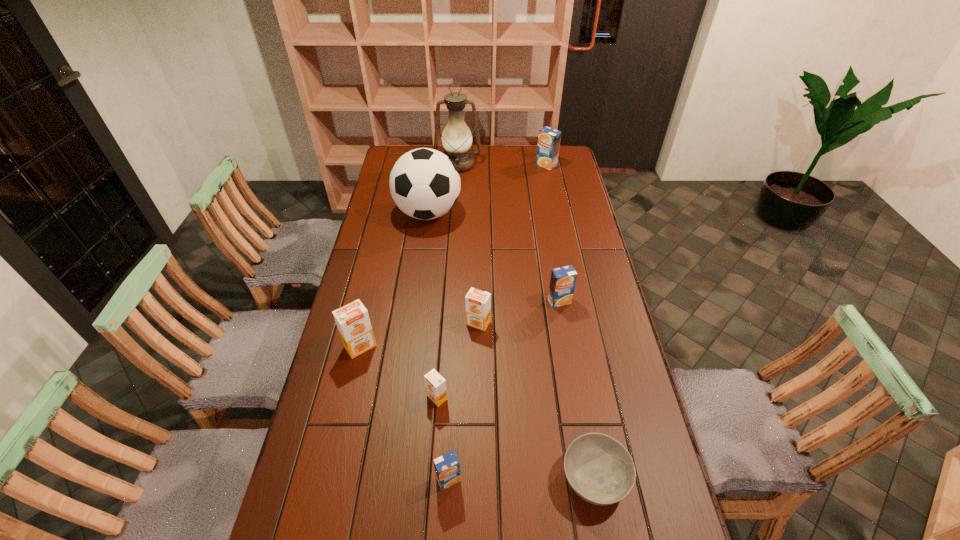
Locate an element on the screen. oil lamp is located at coordinates (457, 138).

Identify the location of the third farthest object. The height and width of the screenshot is (540, 960). (424, 183).

Where is `soccer ball`? The width and height of the screenshot is (960, 540). soccer ball is located at coordinates (424, 183).

You are a GUI agent. You are given a task and a screenshot of the screen. Output one action in this format:
    pyautogui.click(x=<x>, y=<y>)
    Task: Click on the biggest blue orange_juice
    This screenshot has width=960, height=540.
    Given the screenshot: What is the action you would take?
    pyautogui.click(x=549, y=139)

Identify the location of the farthest blue orange_juice. This screenshot has width=960, height=540. (549, 139).

Locate an element on the screen. the leftmost orange juice is located at coordinates (352, 320).

What are the coordinates of `the biggest orange orange juice` in the screenshot? It's located at click(352, 320).

This screenshot has width=960, height=540. I want to click on the second biggest blue orange_juice, so click(x=563, y=279).

Where is `the second nearest blue orange_juice`? the second nearest blue orange_juice is located at coordinates (563, 279).

You are a GUI agent. You are given a task and a screenshot of the screen. Output one action in this format:
    pyautogui.click(x=<x>, y=<y>)
    Task: Click on the fifth nearest object
    
    Given the screenshot: What is the action you would take?
    pyautogui.click(x=478, y=303)